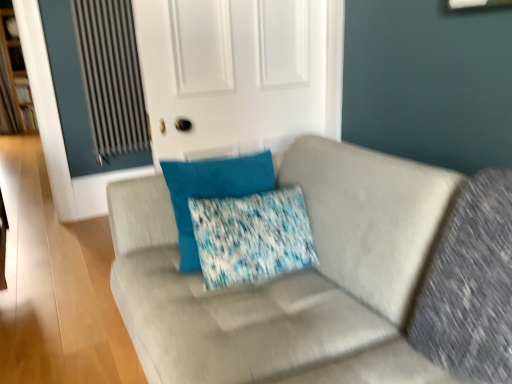
What do you see at coordinates (252, 237) in the screenshot? I see `blue textured pillow at center` at bounding box center [252, 237].

What do you see at coordinates (234, 74) in the screenshot? I see `white matte door at upper center` at bounding box center [234, 74].

At what (x,y) coordinates should I click in order to perform the action: click on blue fabric pillow at center. Please return your answer as a coordinate pair (x, y). This screenshot has width=512, height=384. Looking at the image, I should click on (212, 191).

Could you tell me if white matte door at upper center is facing wooden bookshelf at left?

Yes, white matte door at upper center is facing wooden bookshelf at left.

Considering the sizes of objects white matte door at upper center and wooden bookshelf at left in the image provided, who is thinner, white matte door at upper center or wooden bookshelf at left?

With smaller width is white matte door at upper center.

You are a GUI agent. You are given a task and a screenshot of the screen. Output one action in this format:
    pyautogui.click(x=<x>, y=<y>)
    Task: Click on the bookshelf located behind the white matte door at upper center
    The height and width of the screenshot is (384, 512).
    Given the screenshot: What is the action you would take?
    pyautogui.click(x=13, y=79)

Can you tell me how much metallic ribbed radiator at upper left and suede gray couch at center differ in facing direction?

84.4 degrees separate the facing orientations of metallic ribbed radiator at upper left and suede gray couch at center.

Is metallic ribbed radiator at upper left directly adjacent to suede gray couch at center?

metallic ribbed radiator at upper left and suede gray couch at center are not in contact.

Is point (109, 112) positioned after point (200, 320)?

Yes, it is.

Looking at this image, from a real-world perspective, is metallic ribbed radiator at upper left physically located above or below suede gray couch at center?

metallic ribbed radiator at upper left is situated higher than suede gray couch at center in the real world.

Find the location of `screen door in front of the metallic ribbed radiator at upper left`. screen door in front of the metallic ribbed radiator at upper left is located at coordinates (234, 74).

Is white matte door at upper center positioned with its back to metallic ribbed radiator at upper left?

That's not correct — white matte door at upper center is not looking away from metallic ribbed radiator at upper left.

Does white matte door at upper center lie in front of metallic ribbed radiator at upper left?

That is True.

This screenshot has height=384, width=512. In the image, there is a blue textured pillow at center. What are the coordinates of `screen door above it (from the image's perspective)` in the screenshot? It's located at (234, 74).

From the image's perspective, which object appears higher, white matte door at upper center or blue textured pillow at center?

white matte door at upper center, from the image's perspective.

Is blue textured pillow at center at the back of white matte door at upper center?

Absolutely, white matte door at upper center is directed away from blue textured pillow at center.

Between white matte door at upper center and blue textured pillow at center, which one has smaller size?

blue textured pillow at center.

Is suede gray couch at center at the left side of wooden bookshelf at left?

No, suede gray couch at center is not to the left of wooden bookshelf at left.

Is suede gray couch at center next to wooden bookshelf at left and touching it?

No, suede gray couch at center is not touching wooden bookshelf at left.

Which is correct: suede gray couch at center is inside wooden bookshelf at left, or outside of it?

suede gray couch at center lies outside wooden bookshelf at left.

Which object is closer to the camera taking this photo, suede gray couch at center or wooden bookshelf at left?

suede gray couch at center.

At what (x,y) coordinates should I click in order to perform the action: click on radiator in front of the wooden bookshelf at left. Please return your answer as a coordinate pair (x, y). Looking at the image, I should click on (111, 77).

Based on the photo, which object is closer to the camera taking this photo, metallic ribbed radiator at upper left or wooden bookshelf at left?

Positioned in front is metallic ribbed radiator at upper left.

From a real-world perspective, is metallic ribbed radiator at upper left over wooden bookshelf at left?

No.

How far apart are metallic ribbed radiator at upper left and wooden bookshelf at left?

metallic ribbed radiator at upper left and wooden bookshelf at left are 3.48 meters apart.

Could you tell me if wooden bookshelf at left is turned towards metallic ribbed radiator at upper left?

No, wooden bookshelf at left does not turn towards metallic ribbed radiator at upper left.

From the image's perspective, is wooden bookshelf at left below metallic ribbed radiator at upper left?

No, from the image's perspective, wooden bookshelf at left is not beneath metallic ribbed radiator at upper left.

Is wooden bookshelf at left beside metallic ribbed radiator at upper left?

wooden bookshelf at left and metallic ribbed radiator at upper left are clearly separated.

This screenshot has height=384, width=512. I want to click on bookshelf that appears behind the white matte door at upper center, so click(x=13, y=79).

Locate an element on the screen. This screenshot has width=512, height=384. radiator lying above the suede gray couch at center (from the image's perspective) is located at coordinates (111, 77).

When comparing their distances from blue fabric pillow at center, does white matte door at upper center or suede gray couch at center seem closer?

suede gray couch at center lies closer to blue fabric pillow at center than the other object.

Considering their positions, is metallic ribbed radiator at upper left positioned further to suede gray couch at center than blue textured pillow at center?

metallic ribbed radiator at upper left is further to suede gray couch at center.

Considering their positions, is metallic ribbed radiator at upper left positioned further to wooden bookshelf at left than blue fabric pillow at center?

blue fabric pillow at center is further to wooden bookshelf at left.

Estimate the real-world distances between objects in this image. Which object is closer to metallic ribbed radiator at upper left, wooden bookshelf at left or suede gray couch at center?

The object closer to metallic ribbed radiator at upper left is suede gray couch at center.

From the picture: Looking at the image, which one is located closer to blue fabric pillow at center, blue textured pillow at center or metallic ribbed radiator at upper left?

Based on the image, blue textured pillow at center appears to be nearer to blue fabric pillow at center.

From the image, which object appears to be farther from blue fabric pillow at center, wooden bookshelf at left or blue textured pillow at center?

Among the two, wooden bookshelf at left is located further to blue fabric pillow at center.

Estimate the real-world distances between objects in this image. Which object is closer to suede gray couch at center, white matte door at upper center or wooden bookshelf at left?

white matte door at upper center is closer to suede gray couch at center.

From the image, which object appears to be farther from blue fabric pillow at center, wooden bookshelf at left or suede gray couch at center?

wooden bookshelf at left.

The height and width of the screenshot is (384, 512). Find the location of `pillow between blue textured pillow at center and wooden bookshelf at left from front to back`. pillow between blue textured pillow at center and wooden bookshelf at left from front to back is located at coordinates (212, 191).

The image size is (512, 384). Find the location of `screen door located between suede gray couch at center and metallic ribbed radiator at upper left in the depth direction`. screen door located between suede gray couch at center and metallic ribbed radiator at upper left in the depth direction is located at coordinates pos(234,74).

I want to click on pillow between blue textured pillow at center and metallic ribbed radiator at upper left along the z-axis, so click(x=212, y=191).

The image size is (512, 384). What are the coordinates of `throw pillow between suede gray couch at center and blue fabric pillow at center in the front-back direction` in the screenshot? It's located at (252, 237).